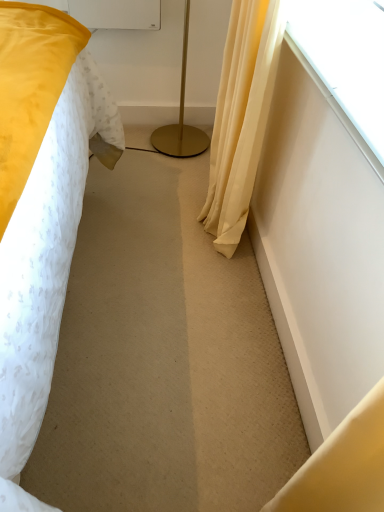
Where is `free location in front of silky yellow curtain at right`? This screenshot has height=512, width=384. free location in front of silky yellow curtain at right is located at coordinates (196, 296).